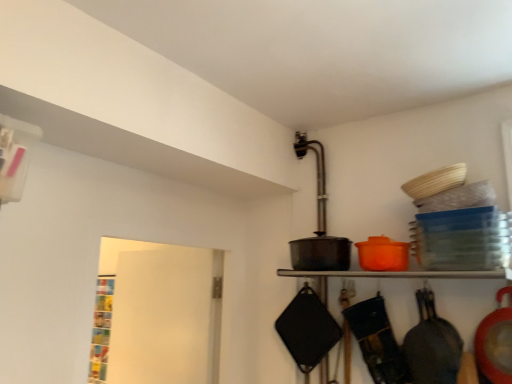
In order to face matte black pot at center, should I rotate leftwards or rightwards?

Rotate your view right by about 17.089°.

Where is `white matte door at left`? white matte door at left is located at coordinates (155, 314).

Which is behind, matte black pot at center or black matte frying pan at lower right, placed as the 1th frying pan when sorted from left to right?

black matte frying pan at lower right, placed as the 1th frying pan when sorted from left to right, is further away from the camera.

Can you confirm if matte black pot at center is shorter than black matte frying pan at lower right, marked as the second frying pan in a right-to-left arrangement?

Indeed, matte black pot at center has a lesser height compared to black matte frying pan at lower right, marked as the second frying pan in a right-to-left arrangement.

Is matte black pot at center directly adjacent to black matte frying pan at lower right, marked as the second frying pan in a right-to-left arrangement?

No.

In the scene shown: From a real-world perspective, is matte black pot at center physically located above or below black matte frying pan at lower right, marked as the second frying pan in a right-to-left arrangement?

In terms of real-world spatial position, matte black pot at center is above black matte frying pan at lower right, marked as the second frying pan in a right-to-left arrangement.

From a real-world perspective, is black matte frying pan at lower right, placed as the 1th frying pan when sorted from left to right, beneath matte black frying pan at right, acting as the second frying pan starting from the left?

Indeed, from a real-world perspective, black matte frying pan at lower right, placed as the 1th frying pan when sorted from left to right, is positioned beneath matte black frying pan at right, acting as the second frying pan starting from the left.

From the image's perspective, which one is positioned higher, black matte frying pan at lower right, marked as the second frying pan in a right-to-left arrangement, or matte black frying pan at right, which is the first frying pan from right to left?

matte black frying pan at right, which is the first frying pan from right to left, from the image's perspective.

Between point (391, 354) and point (437, 356), which one is positioned behind?

The point (391, 354) is behind.

From a real-world perspective, is matte black pot at center physically located above or below matte black frying pan at right, acting as the second frying pan starting from the left?

matte black pot at center is above matte black frying pan at right, acting as the second frying pan starting from the left.

From the image's perspective, relative to matte black frying pan at right, which is the first frying pan from right to left, is matte black pot at center above or below?

matte black pot at center is above matte black frying pan at right, which is the first frying pan from right to left.

The width and height of the screenshot is (512, 384). I want to click on the 1st frying pan below the matte black pot at center (from the image's perspective), so coord(432,345).

Is point (116, 353) farther from viewer compared to point (501, 269)?

Yes, it is.

The image size is (512, 384). What are the coordinates of `window on the left of matte black pot at center` in the screenshot? It's located at (155, 314).

Is matte black pot at center completely or partially inside white matte door at left?

That's incorrect, matte black pot at center is not inside white matte door at left.

From a real-world perspective, which is physically above, white matte door at left or matte black pot at center?

matte black pot at center, from a real-world perspective.

Is matte black frying pan at right, acting as the second frying pan starting from the left, aimed at matte black pot at center?

No, matte black frying pan at right, acting as the second frying pan starting from the left, does not turn towards matte black pot at center.

What's the angular difference between matte black frying pan at right, acting as the second frying pan starting from the left, and matte black pot at center's facing directions?

matte black frying pan at right, acting as the second frying pan starting from the left, and matte black pot at center are facing 0.000232 degrees away from each other.

Looking at this image, can you confirm if matte black frying pan at right, acting as the second frying pan starting from the left, is smaller than matte black pot at center?

No.

Is matte black frying pan at right, which is the first frying pan from right to left, further to the viewer compared to matte black pot at center?

Yes, matte black frying pan at right, which is the first frying pan from right to left, is behind matte black pot at center.

Does point (362, 348) appear closer or farther from the camera than point (198, 252)?

Point (362, 348) appears to be closer to the viewer than point (198, 252).

From a real-world perspective, between black matte frying pan at lower right, marked as the second frying pan in a right-to-left arrangement, and white matte door at left, who is vertically higher?

In real-world perspective, white matte door at left is above.

Between black matte frying pan at lower right, marked as the second frying pan in a right-to-left arrangement, and white matte door at left, which one appears on the right side from the viewer's perspective?

From the viewer's perspective, black matte frying pan at lower right, marked as the second frying pan in a right-to-left arrangement, appears more on the right side.

Is the surface of matte black pot at center in direct contact with white matte door at left?

No, matte black pot at center is not making contact with white matte door at left.

Is matte black pot at center completely or partially outside of white matte door at left?

matte black pot at center is positioned outside white matte door at left.

From their relative heights in the image, would you say matte black pot at center is taller or shorter than white matte door at left?

Clearly, matte black pot at center is shorter compared to white matte door at left.

Where is `shelf that appears in front of the white matte door at left`? shelf that appears in front of the white matte door at left is located at coordinates (401, 274).

The height and width of the screenshot is (384, 512). Find the location of `the 2nd frying pan below the matte black pot at center (from the image's perspective)`. the 2nd frying pan below the matte black pot at center (from the image's perspective) is located at coordinates (377, 341).

At what (x,y) coordinates should I click in order to perform the action: click on frying pan below the matte black frying pan at right, which is the first frying pan from right to left (from a real-world perspective). Please return your answer as a coordinate pair (x, y). Looking at the image, I should click on (377, 341).

Looking at the image, which one is located closer to matte black pot at center, white matte door at left or matte black frying pan at right, acting as the second frying pan starting from the left?

Based on the image, matte black frying pan at right, acting as the second frying pan starting from the left, appears to be nearer to matte black pot at center.

Based on their spatial positions, is matte black frying pan at right, which is the first frying pan from right to left, or matte black pot at center further from black matte frying pan at lower right, placed as the 1th frying pan when sorted from left to right?

matte black pot at center is positioned further to the anchor black matte frying pan at lower right, placed as the 1th frying pan when sorted from left to right.

From the image, which object appears to be nearer to matte black frying pan at right, acting as the second frying pan starting from the left, white matte door at left or black matte frying pan at lower right, placed as the 1th frying pan when sorted from left to right?

black matte frying pan at lower right, placed as the 1th frying pan when sorted from left to right, is positioned closer to the anchor matte black frying pan at right, acting as the second frying pan starting from the left.

Based on their spatial positions, is white matte door at left or black matte frying pan at lower right, marked as the second frying pan in a right-to-left arrangement, closer to matte black pot at center?

Among the two, black matte frying pan at lower right, marked as the second frying pan in a right-to-left arrangement, is located nearer to matte black pot at center.

Considering their positions, is black matte frying pan at lower right, marked as the second frying pan in a right-to-left arrangement, positioned closer to matte black frying pan at right, which is the first frying pan from right to left, than matte black pot at center?

black matte frying pan at lower right, marked as the second frying pan in a right-to-left arrangement, is closer to matte black frying pan at right, which is the first frying pan from right to left.

Estimate the real-world distances between objects in this image. Which object is closer to matte black frying pan at right, which is the first frying pan from right to left, matte black pot at center or white matte door at left?

Among the two, matte black pot at center is located nearer to matte black frying pan at right, which is the first frying pan from right to left.

Considering their positions, is matte black pot at center positioned closer to matte black frying pan at right, which is the first frying pan from right to left, than black matte frying pan at lower right, placed as the 1th frying pan when sorted from left to right?

black matte frying pan at lower right, placed as the 1th frying pan when sorted from left to right, lies closer to matte black frying pan at right, which is the first frying pan from right to left, than the other object.

Based on their spatial positions, is matte black frying pan at right, acting as the second frying pan starting from the left, or black matte frying pan at lower right, placed as the 1th frying pan when sorted from left to right, further from white matte door at left?

matte black frying pan at right, acting as the second frying pan starting from the left.

You are a GUI agent. You are given a task and a screenshot of the screen. Output one action in this format:
    pyautogui.click(x=<x>, y=<y>)
    Task: Click on the frying pan between matte black pot at center and black matte frying pan at lower right, placed as the 1th frying pan when sorted from left to right, in the vertical direction
    
    Given the screenshot: What is the action you would take?
    pyautogui.click(x=432, y=345)

Locate an element on the screen. The width and height of the screenshot is (512, 384). frying pan between white matte door at left and matte black frying pan at right, acting as the second frying pan starting from the left is located at coordinates (377, 341).

This screenshot has width=512, height=384. Find the location of `shelf between white matte door at left and matte black frying pan at right, acting as the second frying pan starting from the left`. shelf between white matte door at left and matte black frying pan at right, acting as the second frying pan starting from the left is located at coordinates (401, 274).

In order to click on frying pan between white matte door at left and matte black pot at center from left to right in this screenshot , I will do click(x=377, y=341).